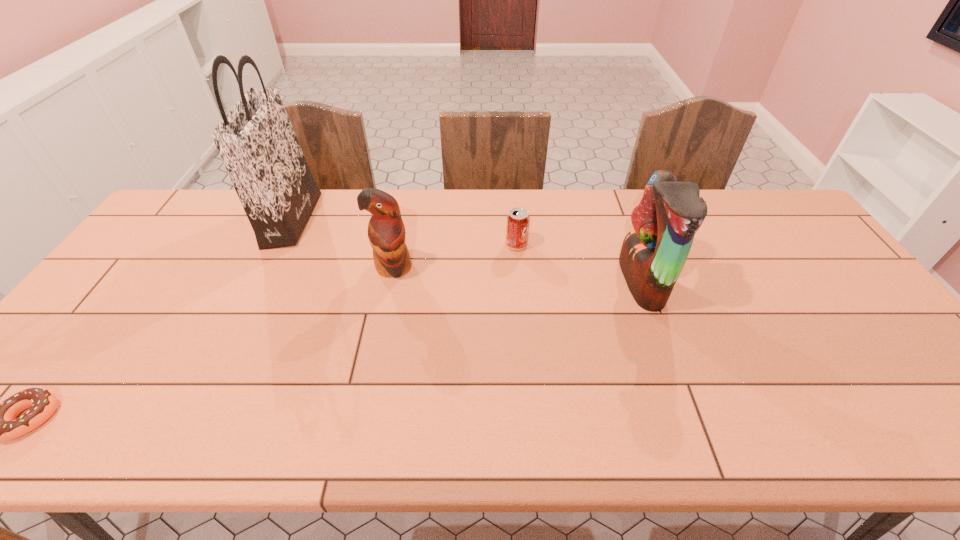
This screenshot has width=960, height=540. Identify the location of vacant space in between the soda can and the right parrot. click(x=579, y=264).

Where is `free area in between the second object from left to right and the third tallest object`? free area in between the second object from left to right and the third tallest object is located at coordinates (343, 244).

The height and width of the screenshot is (540, 960). What are the coordinates of `free space that is in between the second object from right to left and the right parrot` in the screenshot? It's located at (579, 264).

Identify the location of free space between the fourth object from left to right and the right parrot. (579, 264).

Where is `vacant space that's between the fourth object from right to left and the right parrot`? vacant space that's between the fourth object from right to left and the right parrot is located at coordinates (467, 251).

At what (x,y) coordinates should I click in order to perform the action: click on free space between the soda can and the third object from right to left. Please return your answer as a coordinate pair (x, y). The width and height of the screenshot is (960, 540). Looking at the image, I should click on (455, 256).

Point out which object is positioned as the nearest to the second shortest object. Please provide its 2D coordinates. Your answer should be formatted as a tuple, i.e. [(x, y)], where the tuple contains the x and y coordinates of a point satisfying the conditions above.

[(653, 254)]

Identify the location of object identified as the second closest to the right parrot. (386, 232).

Locate an element on the screen. vacant region that satisfies the following two spatial constraints: 1. on the back side of the second object from right to left; 2. on the front of the tallest object with the design is located at coordinates (515, 220).